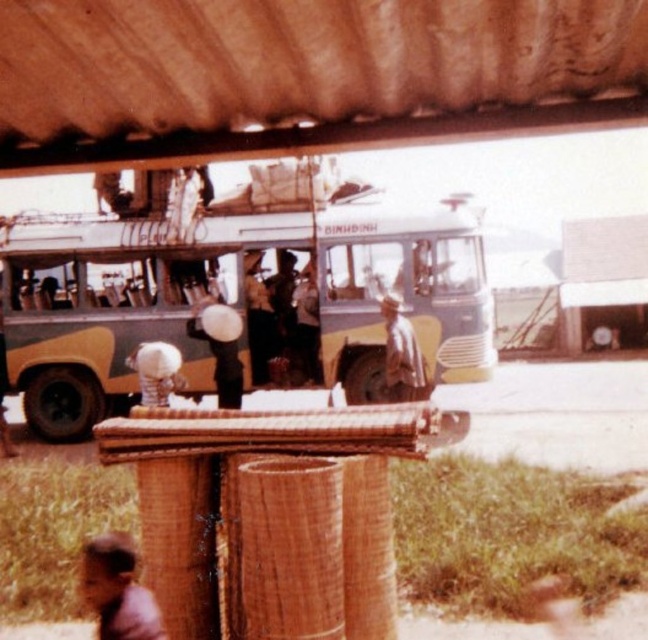
You are a photographer trying to capture both the brown leather jacket at lower left and the white matte hat at center in a single shot. Since you want to ensure both are visible, which object should you focus on first to maintain clarity?

The brown leather jacket at lower left is positioned under the white matte hat at center. To ensure both are visible in the photo, focus on the white matte hat at center first, as it is above the jacket and might be more prominent in the frame.

You are a photographer standing in front of the bus and want to take a picture of both the brown leather jacket at lower left and the white matte hat at center. Which object should you focus on first if you want to ensure both are in the frame without moving the camera?

You should focus on the white matte hat at center first because the brown leather jacket at lower left is not as tall as the white matte hat at center, so adjusting the frame to include the taller hat will naturally include the shorter jacket.